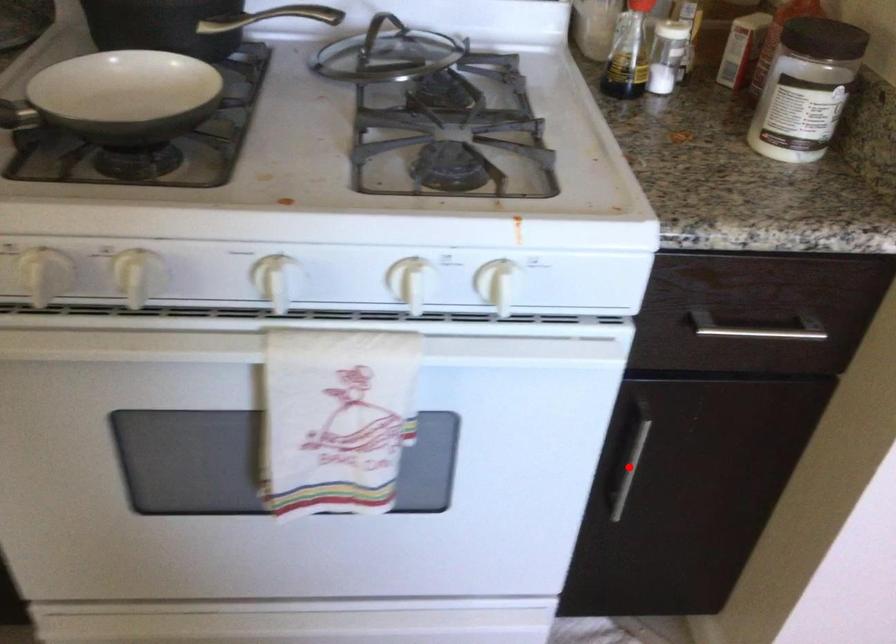
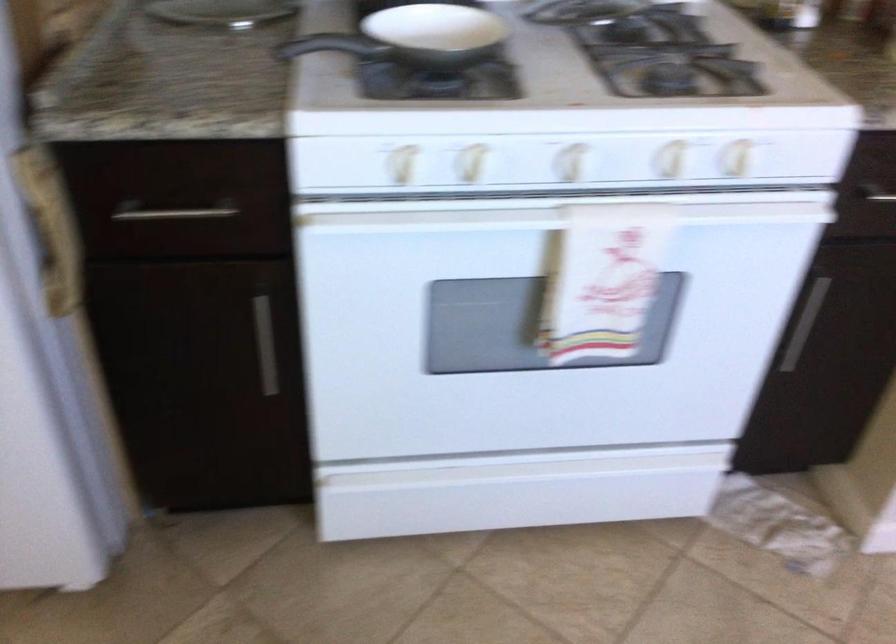
Question: I am providing you with two images of the same scene from different viewpoints. Image1 has a red point marked. In image2, the corresponding 3D location appears at what relative position? Reply with the corresponding letter.

Choices:
 (A) Closer
 (B) Farther

Answer: (B)